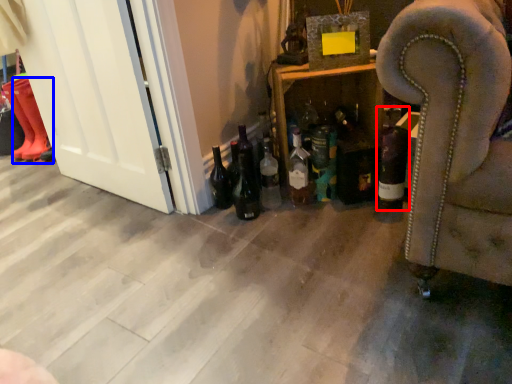
Question: Among these objects, which one is farthest to the camera, bottle (highlighted by a red box) or boot (highlighted by a blue box)?

Choices:
 (A) bottle
 (B) boot

Answer: (B)